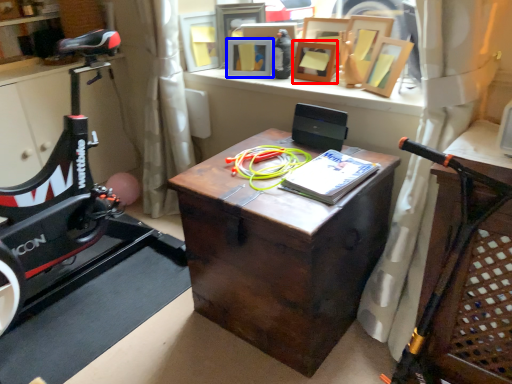
Question: Among these objects, which one is farthest to the camera, picture frame (highlighted by a red box) or picture frame (highlighted by a blue box)?

Choices:
 (A) picture frame
 (B) picture frame

Answer: (B)